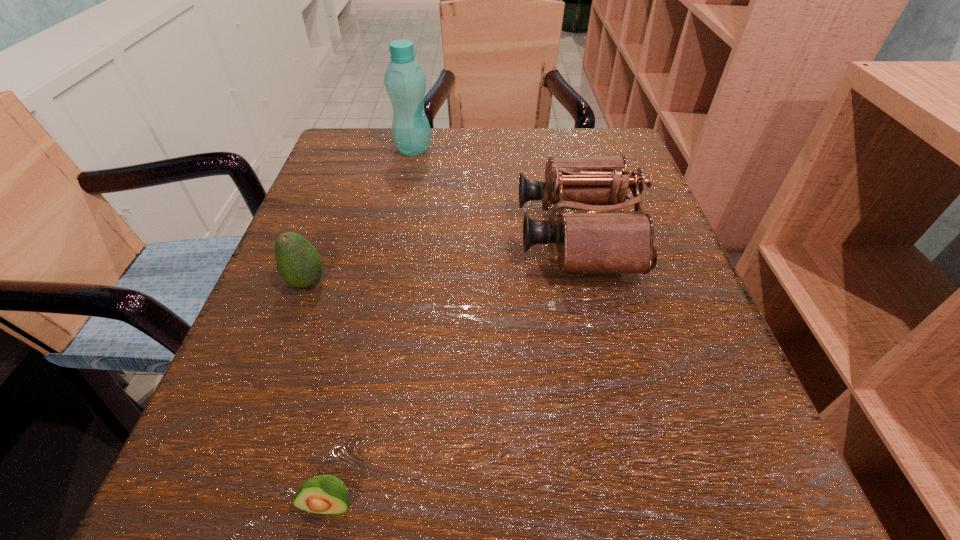
Identify the location of vacant space located through the eyepieces of the binoculars. (362, 235).

At what (x,y) coordinates should I click in order to perform the action: click on vacant space situated 0.380m through the eyepieces of the binoculars. Please return your answer as a coordinate pair (x, y). This screenshot has width=960, height=540. Looking at the image, I should click on (305, 235).

At what (x,y) coordinates should I click in order to perform the action: click on vacant space located 0.100m on the front of the farther avocado. Please return your answer as a coordinate pair (x, y). The height and width of the screenshot is (540, 960). Looking at the image, I should click on (281, 353).

Find the location of `object that is positioned at the far edge`. object that is positioned at the far edge is located at coordinates (405, 81).

Identify the location of object that is positioned at the near edge. The width and height of the screenshot is (960, 540). (324, 494).

The image size is (960, 540). What are the coordinates of `bottle located in the left edge section of the desktop` in the screenshot? It's located at (405, 81).

This screenshot has width=960, height=540. In order to click on object present at the right edge in this screenshot , I will do `click(601, 239)`.

The image size is (960, 540). What are the coordinates of `object that is positioned at the far left corner` in the screenshot? It's located at (405, 81).

I want to click on object located at the near left corner, so click(x=324, y=494).

At what (x,y) coordinates should I click in order to perform the action: click on free space at the far edge of the desktop. Please return your answer as a coordinate pair (x, y). Looking at the image, I should click on (481, 135).